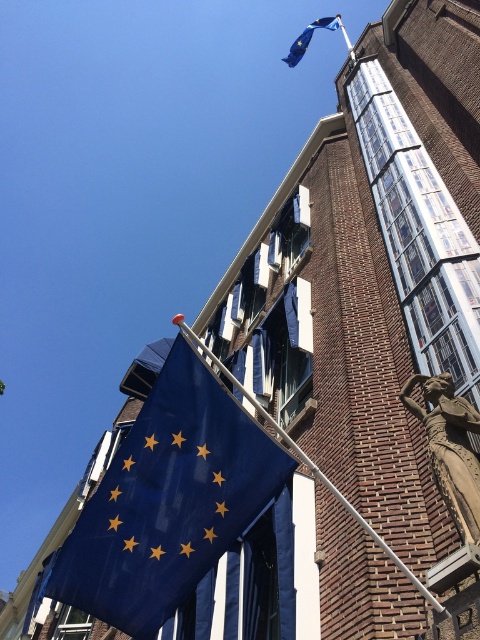
You are an architect assessing the proportions of the flag and pole in the scene. Which object, the blue matte flag at upper left or the metallic silver pole at lower center, is shorter in height?

The blue matte flag at upper left is shorter in height compared to the metallic silver pole at lower center.

You are standing in front of the tall brick building and want to locate the blue matte flag at upper left. According to the coordinates provided, where exactly is the flag positioned?

The blue matte flag at upper left is located at point coordinates of 0.783 on the x axis and 0.350 on the y axis.